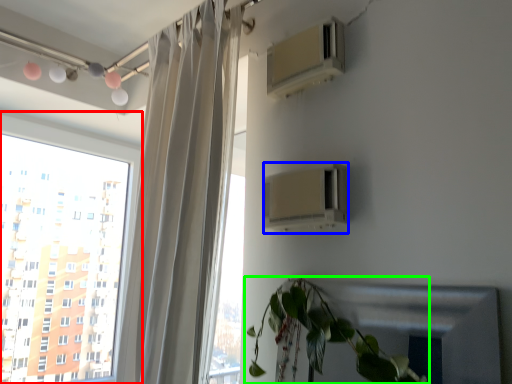
Question: Based on their relative distances, which object is nearer to window (highlighted by a red box)? Choose from air conditioning (highlighted by a blue box) and houseplant (highlighted by a green box).

Choices:
 (A) air conditioning
 (B) houseplant

Answer: (A)